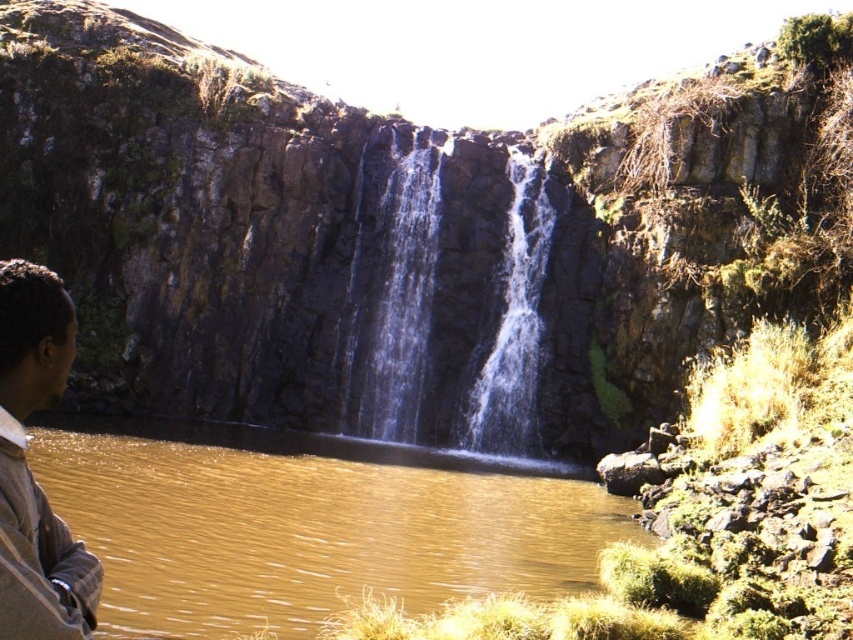
Does brown liquid water at center have a greater height compared to clear glass waterfall at center?

In fact, brown liquid water at center may be shorter than clear glass waterfall at center.

Who is more forward, (x=399, y=592) or (x=386, y=396)?

Point (x=399, y=592)

Who is more distant from viewer, (305, 515) or (357, 348)?

Point (357, 348)

The image size is (853, 640). In order to click on brown liquid water at center in this screenshot , I will do `click(311, 532)`.

Is brown plaid shirt at lower left taller than clear glass waterfall at center?

No.

Is point (44, 365) in front of point (407, 305)?

Yes, point (44, 365) is closer to viewer.

You are a GUI agent. You are given a task and a screenshot of the screen. Output one action in this format:
    pyautogui.click(x=<x>, y=<y>)
    Task: Click on the brown plaid shirt at lower left
    Image resolution: width=853 pixels, height=640 pixels.
    Given the screenshot: What is the action you would take?
    [28, 468]

Does brown plaid shirt at lower left have a smaller size compared to clear water at center?

No, brown plaid shirt at lower left is not smaller than clear water at center.

Which is behind, point (49, 621) or point (517, 346)?

The point (517, 346) is behind.

At what (x,y) coordinates should I click in order to perform the action: click on brown plaid shirt at lower left. Please return your answer as a coordinate pair (x, y). The image size is (853, 640). Looking at the image, I should click on (28, 468).